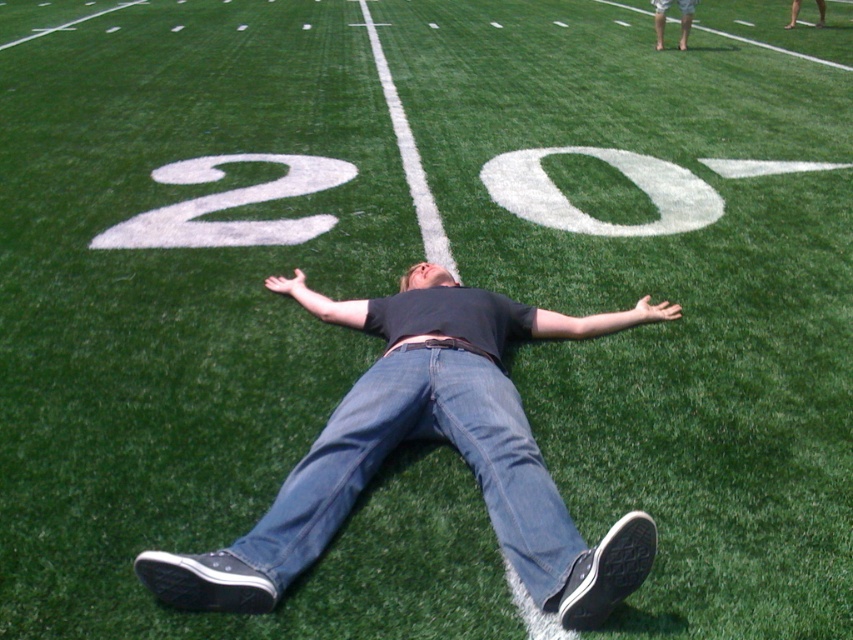
You are standing at the point with coordinates point (160, 211) and want to walk to the point with coordinates point (456, 365). Which direction should you move to reach your destination?

You should move forward because point (456, 365) is in front of point (160, 211).

You are a photographer trying to capture a closeup shot of the person on the football field. You need to ensure that both the denim jeans at center and the smooth skin legs at upper right are clearly visible in the frame. Given their sizes, which object should you focus on first to ensure proper framing?

The denim jeans at center is bigger than the smooth skin legs at upper right, so you should focus on the denim jeans at center first to ensure proper framing since it takes up more space in the image.

You are a photographer trying to capture a closeup of the white painted number at center and the matte black belt at center. Which object should you zoom in on to ensure both are in focus without moving the camera?

The white painted number at center is bigger than the matte black belt at center, so you should zoom in on the white painted number at center to ensure both are in focus without moving the camera.